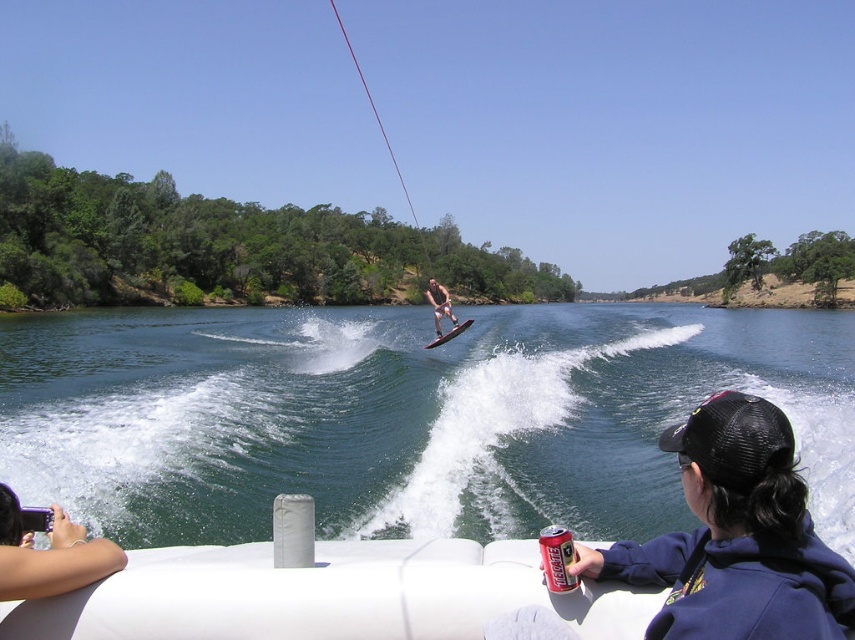
Does point (429, 294) come behind point (447, 337)?

No.

Between point (435, 284) and point (438, 342), which one is positioned in front?

Point (435, 284)

Identify the location of smooth tan skin at center. (439, 305).

The height and width of the screenshot is (640, 855). In order to click on skinny jeans at lower left in this screenshot , I will do `click(49, 554)`.

Is point (15, 515) positioned after point (467, 317)?

No.

Is point (113, 548) closer to viewer compared to point (429, 348)?

Yes, it is.

At what (x,y) coordinates should I click in order to perform the action: click on skinny jeans at lower left. Please return your answer as a coordinate pair (x, y). Looking at the image, I should click on (49, 554).

Is brushed metal can at lower center above smooth tan skin at center?

Actually, brushed metal can at lower center is below smooth tan skin at center.

In the scene shown: Between brushed metal can at lower center and smooth tan skin at center, which one has more height?

With more height is smooth tan skin at center.

Locate an element on the screen. brushed metal can at lower center is located at coordinates (557, 557).